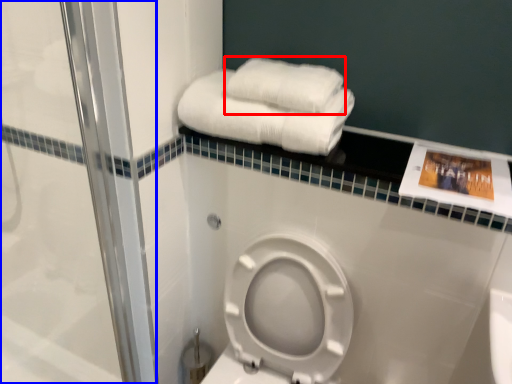
Question: Which object appears farthest to the camera in this image, towel (highlighted by a red box) or shower door (highlighted by a blue box)?

Choices:
 (A) towel
 (B) shower door

Answer: (A)